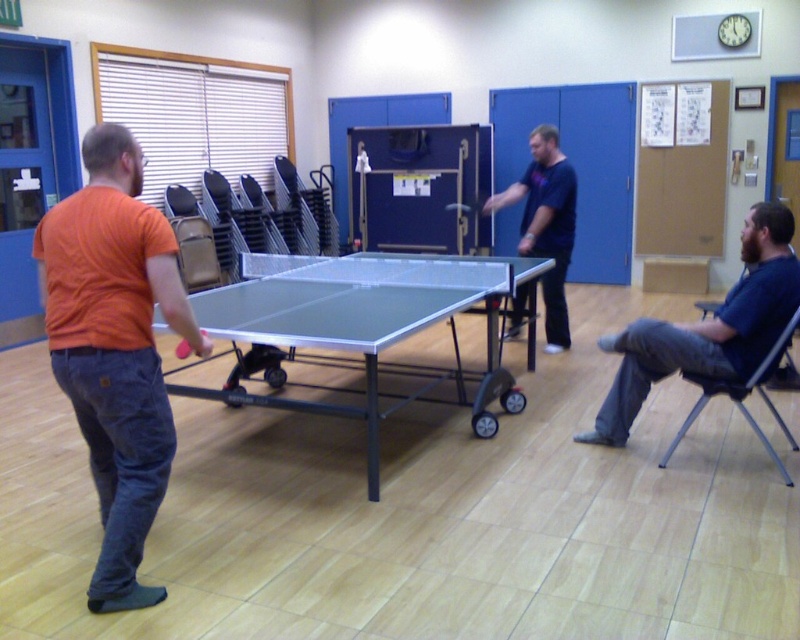
You are standing at the point labeled point (145, 205) in the image. You want to move to the ping pong table which is 2.36 meters away from you. Is there enough space to walk straight to the table without any obstacles?

Yes, there is enough space to walk straight to the ping pong table because the distance between you and the table is 2.36 meters, and the scene description mentions no obstacles in the room.

You are standing at the entrance of the room and want to greet the person in the blue cotton shirt at right. To reach them, you must walk around the ping pong table with wheels attached to its legs. Which direction should you walk to avoid the metallic gray chair at lower right?

The blue cotton shirt at right is above the metallic gray chair at lower right, so the chair is directly beneath them. To avoid the chair, walk around the ping pong table towards the side opposite the metallic gray chair at lower right.

You are a photographer setting up a shoot in this room. You need to place a 1.2 meter tall stand between the blue cotton shirt at right and the metallic gray chair at lower right. Will the stand fit vertically between them?

The blue cotton shirt at right is taller than the metallic gray chair at lower right. Since the stand is 1.2 meters tall, it may not fit vertically between them if the distance between the two objects is less than 1.2 meters. However, the description only provides information about their heights relative to each other, not the vertical space between them. Without knowing the actual vertical distance, we cannot confirm if the stand will fit.